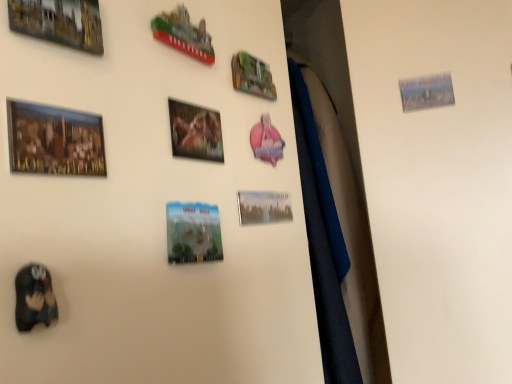
What is the approximate height of metallic silver picture frame at center, the seventh picture frame when ordered from left to right?

1.83 inches.

Measure the distance between point (266, 193) and camera.

Point (266, 193) is 21.73 inches away from camera.

Image resolution: width=512 pixels, height=384 pixels. Describe the element at coordinates (184, 34) in the screenshot. I see `green plastic magnet at upper center, placed as the 6th picture frame when sorted from right to left` at that location.

What do you see at coordinates (59, 22) in the screenshot? This screenshot has height=384, width=512. I see `gold metallic picture frame at upper left, the 8th picture frame when ordered from right to left` at bounding box center [59, 22].

The image size is (512, 384). What are the coordinates of `metallic green sign at upper center, placed as the third picture frame when sorted from right to left` in the screenshot? It's located at (252, 76).

From the picture: From a real-world perspective, is gold metallic picture frame at upper left, the 8th picture frame when ordered from right to left, positioned above or below matte black owl at lower left?

Clearly, from a real-world perspective, gold metallic picture frame at upper left, the 8th picture frame when ordered from right to left, is above matte black owl at lower left.

In the scene shown: Is gold metallic picture frame at upper left, arranged as the first picture frame when viewed from the left, aimed at matte black owl at lower left?

No, gold metallic picture frame at upper left, arranged as the first picture frame when viewed from the left, is not facing towards matte black owl at lower left.

Is gold metallic picture frame at upper left, the 8th picture frame when ordered from right to left, taller than matte black owl at lower left?

Indeed, gold metallic picture frame at upper left, the 8th picture frame when ordered from right to left, has a greater height compared to matte black owl at lower left.

Would you say matte black owl at lower left is a long distance from green plastic magnet at upper center, acting as the third picture frame starting from the left?

No, matte black owl at lower left is in close proximity to green plastic magnet at upper center, acting as the third picture frame starting from the left.

Between matte black owl at lower left and green plastic magnet at upper center, acting as the third picture frame starting from the left, which one is positioned in front?

matte black owl at lower left is more forward.

From a real-world perspective, which is physically above, matte black owl at lower left or green plastic magnet at upper center, acting as the third picture frame starting from the left?

green plastic magnet at upper center, acting as the third picture frame starting from the left, from a real-world perspective.

How different are the orientations of matte black owl at lower left and green plastic magnet at upper center, placed as the 6th picture frame when sorted from right to left, in degrees?

matte black owl at lower left and green plastic magnet at upper center, placed as the 6th picture frame when sorted from right to left, are facing 3.09 degrees away from each other.

Is metallic silver picture frame at center, the 2th picture frame positioned from the right, surrounding matte plastic magnet at center, marked as the 4th picture frame in a right-to-left arrangement?

No, matte plastic magnet at center, marked as the 4th picture frame in a right-to-left arrangement, is not a part of metallic silver picture frame at center, the 2th picture frame positioned from the right.

Is metallic silver picture frame at center, the seventh picture frame when ordered from left to right, facing away from matte plastic magnet at center, marked as the 4th picture frame in a right-to-left arrangement?

No, metallic silver picture frame at center, the seventh picture frame when ordered from left to right, is not facing the opposite direction of matte plastic magnet at center, marked as the 4th picture frame in a right-to-left arrangement.

Considering the positions of objects metallic silver picture frame at center, the seventh picture frame when ordered from left to right, and matte plastic magnet at center, marked as the 4th picture frame in a right-to-left arrangement, in the image provided, who is more to the right, metallic silver picture frame at center, the seventh picture frame when ordered from left to right, or matte plastic magnet at center, marked as the 4th picture frame in a right-to-left arrangement,?

metallic silver picture frame at center, the seventh picture frame when ordered from left to right.

Relative to matte plastic magnet at center, the 5th picture frame from the left, is metallic silver picture frame at center, the seventh picture frame when ordered from left to right, in front or behind?

metallic silver picture frame at center, the seventh picture frame when ordered from left to right, is positioned farther from the viewer than matte plastic magnet at center, the 5th picture frame from the left.

From a real-world perspective, who is located lower, matte wooden picture frame at upper left, which appears as the seventh picture frame when viewed from the right, or matte plastic magnet at center, marked as the 4th picture frame in a right-to-left arrangement?

matte plastic magnet at center, marked as the 4th picture frame in a right-to-left arrangement, is physically lower.

Looking at the image, does matte wooden picture frame at upper left, positioned as the 2th picture frame in left-to-right order, seem bigger or smaller compared to matte plastic magnet at center, marked as the 4th picture frame in a right-to-left arrangement?

Clearly, matte wooden picture frame at upper left, positioned as the 2th picture frame in left-to-right order, is smaller in size than matte plastic magnet at center, marked as the 4th picture frame in a right-to-left arrangement.

Is matte wooden picture frame at upper left, which appears as the seventh picture frame when viewed from the right, situated inside matte plastic magnet at center, the 5th picture frame from the left, or outside?

matte wooden picture frame at upper left, which appears as the seventh picture frame when viewed from the right, is not inside matte plastic magnet at center, the 5th picture frame from the left, it's outside.

Identify the location of the 2nd picture frame directly above the matte plastic magnet at center, the 5th picture frame from the left (from a real-world perspective). This screenshot has height=384, width=512. (54, 140).

Between matte plastic magnet at center, the 5th picture frame from the left, and metallic silver photo frame at upper right, which is the 1th picture frame from right to left, which one appears on the right side from the viewer's perspective?

metallic silver photo frame at upper right, which is the 1th picture frame from right to left, is more to the right.

Does point (220, 250) come closer to viewer compared to point (429, 96)?

Yes, it is in front of point (429, 96).

Is matte plastic magnet at center, the 5th picture frame from the left, further to camera compared to metallic silver photo frame at upper right, which appears as the eighth picture frame when viewed from the left?

No, matte plastic magnet at center, the 5th picture frame from the left, is in front of metallic silver photo frame at upper right, which appears as the eighth picture frame when viewed from the left.

In terms of width, does matte plastic magnet at center, the 5th picture frame from the left, look wider or thinner when compared to metallic silver photo frame at upper right, which appears as the eighth picture frame when viewed from the left?

In the image, matte plastic magnet at center, the 5th picture frame from the left, appears to be wider than metallic silver photo frame at upper right, which appears as the eighth picture frame when viewed from the left.

Does point (77, 17) come farther from viewer compared to point (433, 80)?

No, (77, 17) is closer to viewer.

From a real-world perspective, is gold metallic picture frame at upper left, arranged as the first picture frame when viewed from the left, physically below metallic silver photo frame at upper right, which is the 1th picture frame from right to left?

No.

How different are the orientations of gold metallic picture frame at upper left, the 8th picture frame when ordered from right to left, and metallic silver photo frame at upper right, which is the 1th picture frame from right to left, in degrees?

The facing directions of gold metallic picture frame at upper left, the 8th picture frame when ordered from right to left, and metallic silver photo frame at upper right, which is the 1th picture frame from right to left, are 64.7 degrees apart.

From a real-world perspective, is green plastic magnet at upper center, placed as the 6th picture frame when sorted from right to left, physically above metallic glossy photo frame at center, which is the fourth picture frame from left to right?

Yes, from a real-world perspective, green plastic magnet at upper center, placed as the 6th picture frame when sorted from right to left, is over metallic glossy photo frame at center, which is the fourth picture frame from left to right

From their relative heights in the image, would you say green plastic magnet at upper center, placed as the 6th picture frame when sorted from right to left, is taller or shorter than metallic glossy photo frame at center, the fifth picture frame positioned from the right?

Considering their sizes, green plastic magnet at upper center, placed as the 6th picture frame when sorted from right to left, has more height than metallic glossy photo frame at center, the fifth picture frame positioned from the right.

Based on the photo, is green plastic magnet at upper center, placed as the 6th picture frame when sorted from right to left, turned away from metallic glossy photo frame at center, the fifth picture frame positioned from the right?

That's not correct — green plastic magnet at upper center, placed as the 6th picture frame when sorted from right to left, is not looking away from metallic glossy photo frame at center, the fifth picture frame positioned from the right.

In the image, there is a gold metallic picture frame at upper left, the 8th picture frame when ordered from right to left. What are the coordinates of `art below it (from a real-world perspective)` in the screenshot? It's located at (34, 297).

This screenshot has height=384, width=512. In order to click on picture frame that is the 4th one when counting backward from the matte black owl at lower left in this screenshot , I will do `click(184, 34)`.

Looking at the image, which one is located further to metallic silver photo frame at upper right, which is the 1th picture frame from right to left, metallic silver picture frame at center, the seventh picture frame when ordered from left to right, or metallic green sign at upper center, placed as the third picture frame when sorted from right to left?

The object further to metallic silver photo frame at upper right, which is the 1th picture frame from right to left, is metallic silver picture frame at center, the seventh picture frame when ordered from left to right.

Looking at the image, which one is located further to metallic silver photo frame at upper right, which is the 1th picture frame from right to left, matte wooden picture frame at upper left, positioned as the 2th picture frame in left-to-right order, or metallic green sign at upper center, marked as the 6th picture frame in a left-to-right arrangement?

The object further to metallic silver photo frame at upper right, which is the 1th picture frame from right to left, is matte wooden picture frame at upper left, positioned as the 2th picture frame in left-to-right order.

From the image, which object appears to be nearer to matte black owl at lower left, green plastic magnet at upper center, placed as the 6th picture frame when sorted from right to left, or gold metallic picture frame at upper left, the 8th picture frame when ordered from right to left?

gold metallic picture frame at upper left, the 8th picture frame when ordered from right to left, lies closer to matte black owl at lower left than the other object.

From the image, which object appears to be nearer to matte black owl at lower left, matte wooden picture frame at upper left, which appears as the seventh picture frame when viewed from the right, or metallic green sign at upper center, marked as the 6th picture frame in a left-to-right arrangement?

matte wooden picture frame at upper left, which appears as the seventh picture frame when viewed from the right, is positioned closer to the anchor matte black owl at lower left.

From the image, which object appears to be farther from metallic glossy photo frame at center, the fifth picture frame positioned from the right, metallic silver photo frame at upper right, which appears as the eighth picture frame when viewed from the left, or green plastic magnet at upper center, placed as the 6th picture frame when sorted from right to left?

metallic silver photo frame at upper right, which appears as the eighth picture frame when viewed from the left, is further to metallic glossy photo frame at center, the fifth picture frame positioned from the right.

When comparing their distances from metallic silver picture frame at center, the 2th picture frame positioned from the right, does green plastic magnet at upper center, acting as the third picture frame starting from the left, or matte plastic magnet at center, marked as the 4th picture frame in a right-to-left arrangement, seem closer?

Among the two, matte plastic magnet at center, marked as the 4th picture frame in a right-to-left arrangement, is located nearer to metallic silver picture frame at center, the 2th picture frame positioned from the right.

Considering their positions, is matte plastic magnet at center, the 5th picture frame from the left, positioned closer to metallic glossy photo frame at center, the fifth picture frame positioned from the right, than gold metallic picture frame at upper left, arranged as the first picture frame when viewed from the left?

Based on the image, matte plastic magnet at center, the 5th picture frame from the left, appears to be nearer to metallic glossy photo frame at center, the fifth picture frame positioned from the right.

Based on their spatial positions, is metallic green sign at upper center, placed as the third picture frame when sorted from right to left, or gold metallic picture frame at upper left, arranged as the first picture frame when viewed from the left, further from matte wooden picture frame at upper left, which appears as the seventh picture frame when viewed from the right?

Based on the image, metallic green sign at upper center, placed as the third picture frame when sorted from right to left, appears to be further to matte wooden picture frame at upper left, which appears as the seventh picture frame when viewed from the right.

The height and width of the screenshot is (384, 512). Identify the location of art between gold metallic picture frame at upper left, arranged as the first picture frame when viewed from the left, and metallic silver photo frame at upper right, which appears as the eighth picture frame when viewed from the left, from left to right. [34, 297].

Where is `picture frame between metallic green sign at upper center, marked as the 6th picture frame in a left-to-right arrangement, and metallic silver photo frame at upper right, which appears as the eighth picture frame when viewed from the left`? picture frame between metallic green sign at upper center, marked as the 6th picture frame in a left-to-right arrangement, and metallic silver photo frame at upper right, which appears as the eighth picture frame when viewed from the left is located at coordinates (263, 207).